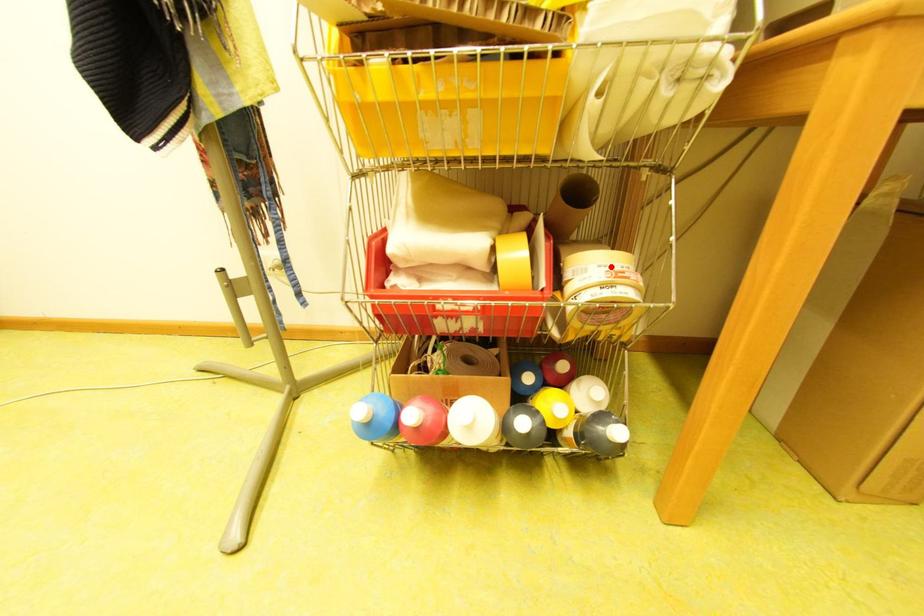
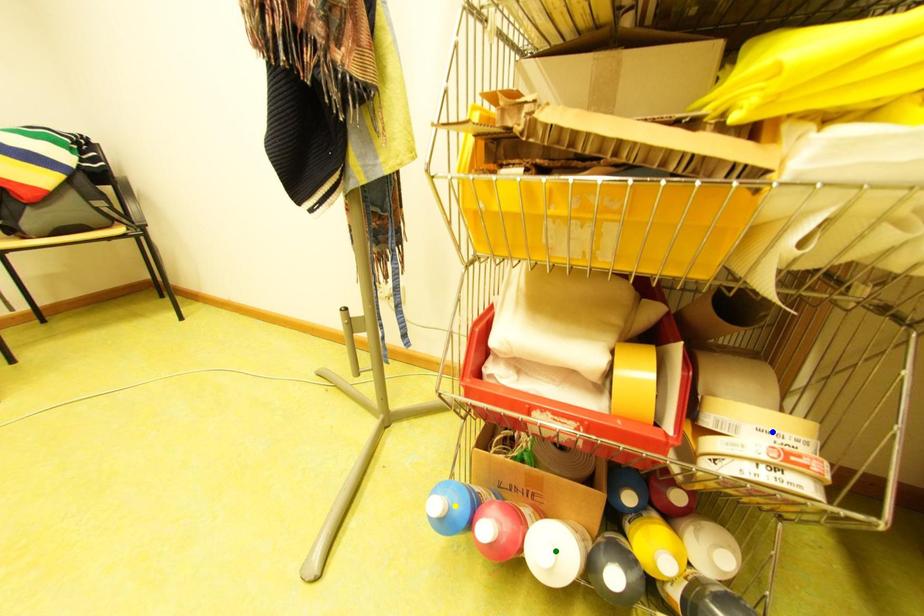
Question: I am providing you with two images of the same scene from different viewpoints. A red point is marked on the first image. You are given multiple points on the second image. Which point in image 2 is actually the same real-world point as the red point in image 1?

Choices:
 (A) blue point
 (B) yellow point
 (C) green point

Answer: (A)